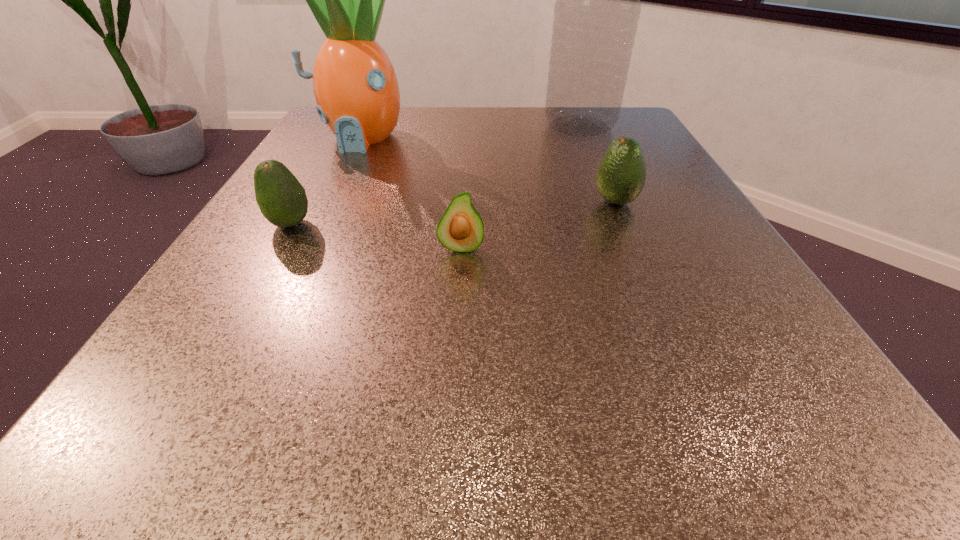
You are a GUI agent. You are given a task and a screenshot of the screen. Output one action in this format:
    pyautogui.click(x=<x>, y=<y>)
    Task: Click on the vacant space situated on the cut side of the third object from left to right
    This screenshot has width=960, height=540.
    Given the screenshot: What is the action you would take?
    pyautogui.click(x=454, y=377)

Image resolution: width=960 pixels, height=540 pixels. Find the location of `water jug at the far edge`. water jug at the far edge is located at coordinates (597, 8).

Find the location of `pineapple that is positioned at the far edge`. pineapple that is positioned at the far edge is located at coordinates (356, 89).

Locate an element on the screen. pineapple that is at the left edge is located at coordinates (356, 89).

At what (x,y) coordinates should I click in order to perform the action: click on avocado that is positioned at the left edge. Please return your answer as a coordinate pair (x, y). This screenshot has width=960, height=540. Looking at the image, I should click on (282, 200).

Identify the location of water jug located at the right edge. Image resolution: width=960 pixels, height=540 pixels. (597, 8).

This screenshot has width=960, height=540. Find the location of `avocado present at the right edge`. avocado present at the right edge is located at coordinates (621, 175).

This screenshot has width=960, height=540. Identify the location of object positioned at the far left corner. (356, 89).

I want to click on object present at the far right corner, so click(597, 8).

Identify the location of free region at the far edge of the desktop. (563, 144).